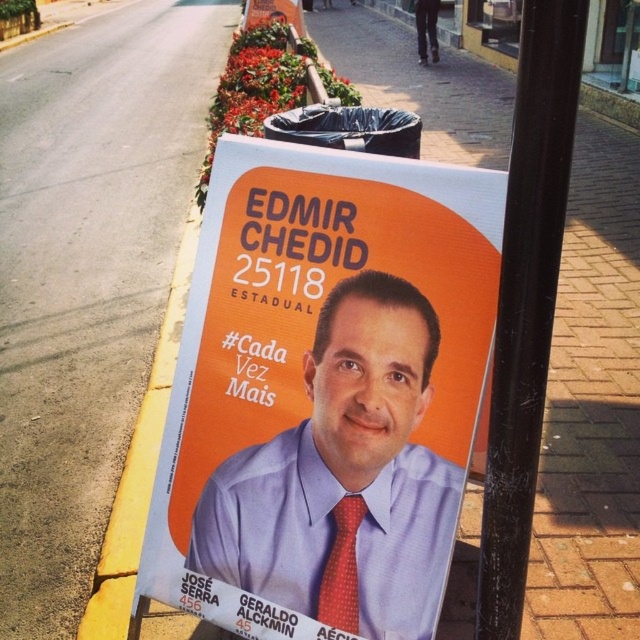
Question: Which of the following is the closest to the observer?

Choices:
 (A) red dotted fabric tie at center
 (B) orange matte poster at upper center
 (C) matte blue shirt at center

Answer: (C)

Question: Can you confirm if orange paper poster at center is positioned to the left of red dotted fabric tie at center?

Choices:
 (A) no
 (B) yes

Answer: (B)

Question: Which object is closer to the camera taking this photo?

Choices:
 (A) matte blue shirt at center
 (B) orange matte poster at upper center

Answer: (A)

Question: Estimate the real-world distances between objects in this image. Which object is farther from the black metal pole at center?

Choices:
 (A) red dotted fabric tie at center
 (B) orange matte poster at upper center
 (C) matte blue shirt at center
 (D) orange paper poster at center

Answer: (B)

Question: Is orange paper poster at center positioned at the back of black metal pole at center?

Choices:
 (A) no
 (B) yes

Answer: (B)

Question: Is black metal pole at center below red dotted fabric tie at center?

Choices:
 (A) no
 (B) yes

Answer: (A)